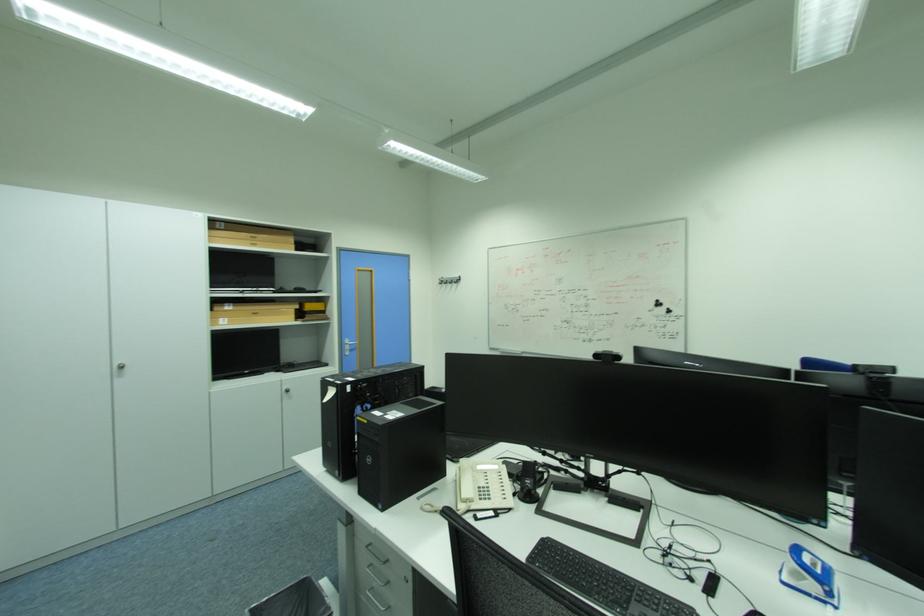
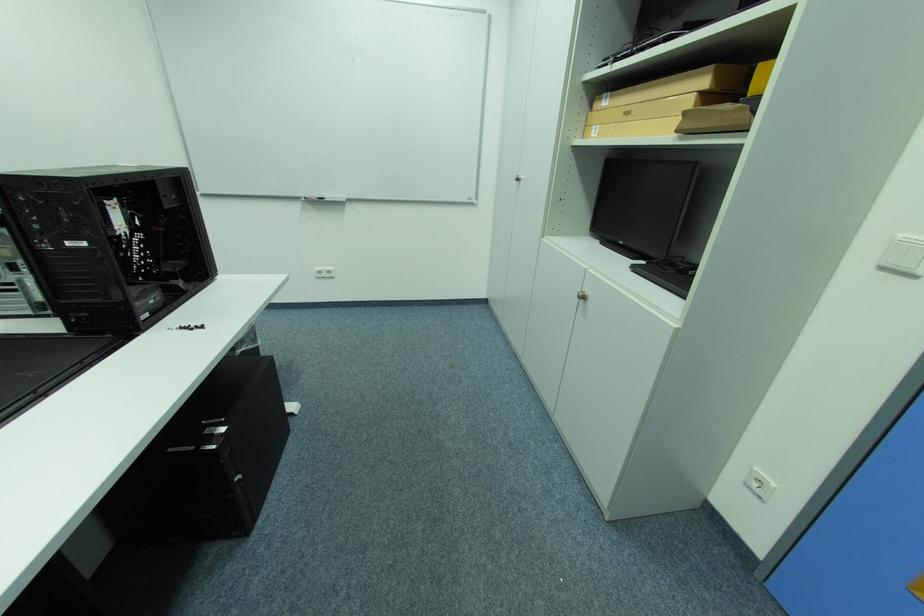
Locate, in the second image, the point that corresponds to [237,306] in the first image.

(614, 98)